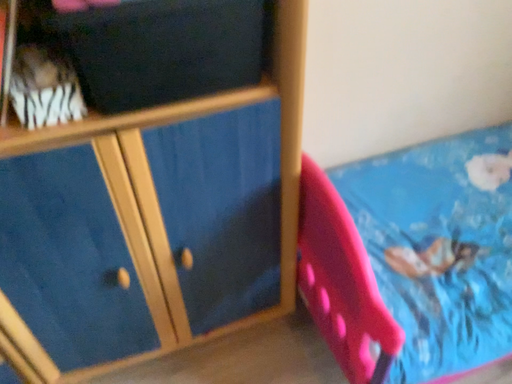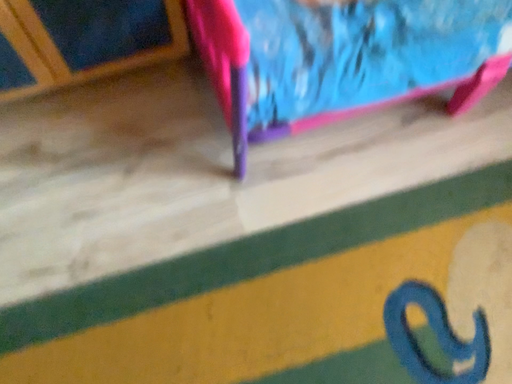
Question: Which way did the camera rotate in the video?

Choices:
 (A) rotated upward
 (B) rotated downward

Answer: (B)